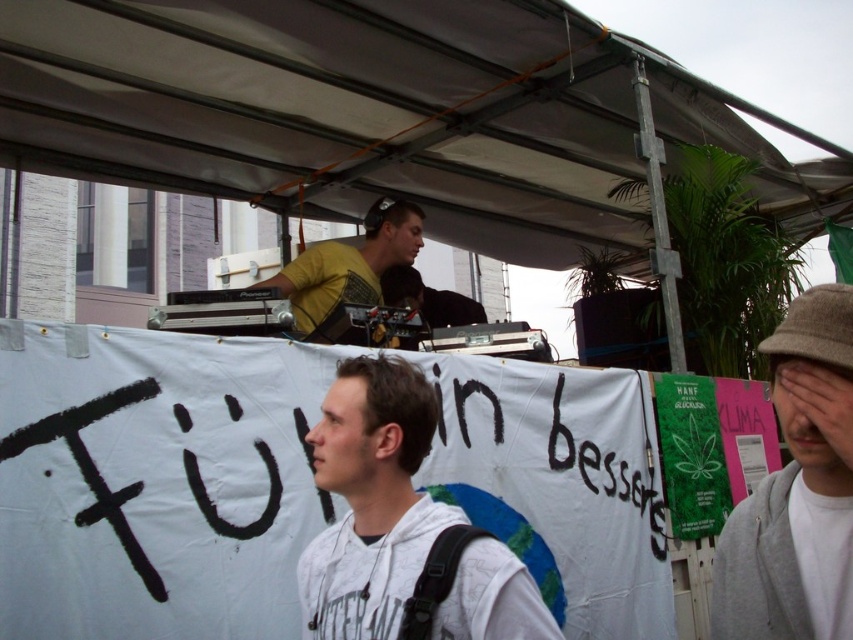
Question: Does white hoodie at center lie behind gray woolen hat at lower right?

Choices:
 (A) no
 (B) yes

Answer: (B)

Question: Based on their relative distances, which object is farther from the yellow matte shirt at upper center?

Choices:
 (A) white hoodie at center
 (B) gray woolen hat at lower right

Answer: (B)

Question: Which object is positioned farthest from the white hoodie at center?

Choices:
 (A) yellow matte shirt at upper center
 (B) white fabric canopy at upper center
 (C) gray woolen hat at lower right

Answer: (B)

Question: Is white fabric canopy at upper center to the right of gray woolen hat at lower right from the viewer's perspective?

Choices:
 (A) yes
 (B) no

Answer: (B)

Question: Which object is the farthest from the white fabric canopy at upper center?

Choices:
 (A) gray woolen hat at lower right
 (B) white hoodie at center
 (C) yellow matte shirt at upper center

Answer: (A)

Question: Can you confirm if gray woolen hat at lower right is smaller than yellow matte shirt at upper center?

Choices:
 (A) yes
 (B) no

Answer: (A)